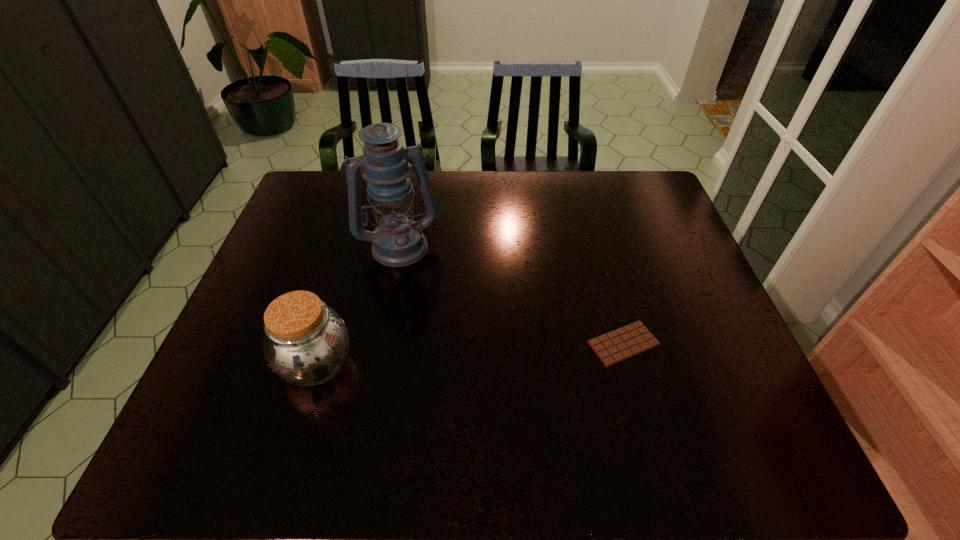
In order to click on free space on the desktop that is between the second tallest object and the candy bar and is positioned on the front-facing side of the lantern in this screenshot , I will do click(x=441, y=356).